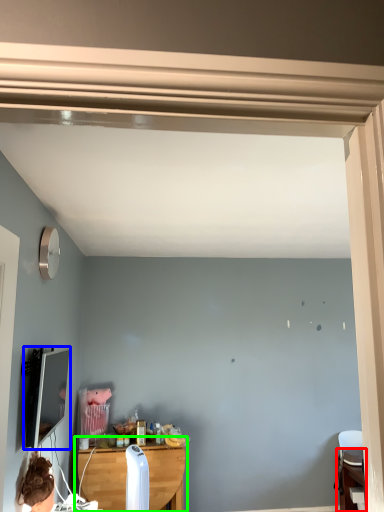
Question: Estimate the real-world distances between objects in this image. Which object is closer to table (highlighted by a red box), computer monitor (highlighted by a blue box) or table (highlighted by a green box)?

Choices:
 (A) computer monitor
 (B) table

Answer: (B)